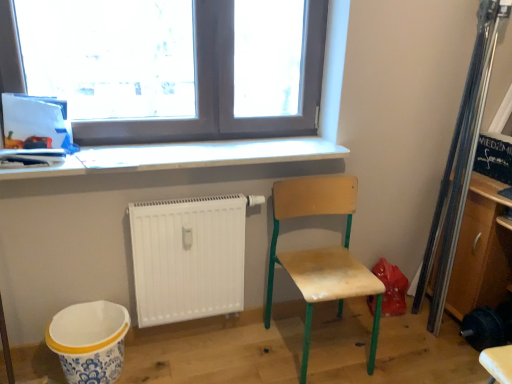
In order to face white ceramic mixing bowl at lower left, should I rotate leftwards or rightwards?

It's best to rotate left around 20.884 degrees.

This screenshot has width=512, height=384. What do you see at coordinates (176, 66) in the screenshot?
I see `transparent glass window at upper center` at bounding box center [176, 66].

What are the coordinates of `wooden cabinet at right` in the screenshot? It's located at (481, 250).

Identify the location of white glossy counter top at upper center. This screenshot has width=512, height=384. click(x=184, y=156).

Between white matte radiator at lower center and transparent glass window at upper center, which one has more height?

Standing taller between the two is transparent glass window at upper center.

Does point (172, 283) appear closer or farther from the camera than point (311, 16)?

Clearly, point (172, 283) is closer to the camera than point (311, 16).

From a real-world perspective, is white matte radiator at lower center physically above transparent glass window at upper center?

No.

Is white matte radiator at lower center facing towards transparent glass window at upper center?

No, white matte radiator at lower center is not turned towards transparent glass window at upper center.

From the image's perspective, which object appears higher, wooden cabinet at right or white ceramic mixing bowl at lower left?

wooden cabinet at right is shown above in the image.

Does wooden cabinet at right have a lesser height compared to white ceramic mixing bowl at lower left?

In fact, wooden cabinet at right may be taller than white ceramic mixing bowl at lower left.

Consider the image. Would you say wooden cabinet at right is inside or outside white ceramic mixing bowl at lower left?

wooden cabinet at right lies outside white ceramic mixing bowl at lower left.

How different are the orientations of white glossy counter top at upper center and wooden cabinet at right in degrees?

The facing directions of white glossy counter top at upper center and wooden cabinet at right are 90.1 degrees apart.

Considering the relative positions of white glossy counter top at upper center and wooden cabinet at right in the image provided, is white glossy counter top at upper center to the left or to the right of wooden cabinet at right?

white glossy counter top at upper center is to the left of wooden cabinet at right.

Is white glossy counter top at upper center spatially inside wooden cabinet at right, or outside of it?

white glossy counter top at upper center is spatially situated outside wooden cabinet at right.

From the image's perspective, does transparent glass window at upper center appear higher than wooden cabinet at right?

Yes.

Between point (199, 57) and point (455, 309), which one is positioned in front?

The point (199, 57) is closer.

In the scene shown: Is transparent glass window at upper center positioned behind wooden cabinet at right?

No, transparent glass window at upper center is in front of wooden cabinet at right.

Is transparent glass window at upper center taller or shorter than wooden cabinet at right?

In the image, transparent glass window at upper center appears to be shorter than wooden cabinet at right.

Would you say white matte radiator at lower center is part of wooden cabinet at right's contents?

No, white matte radiator at lower center is located outside of wooden cabinet at right.

Is wooden cabinet at right positioned with its back to white matte radiator at lower center?

No, white matte radiator at lower center is not at the back of wooden cabinet at right.

Considering the relative positions of wooden cabinet at right and white matte radiator at lower center in the image provided, is wooden cabinet at right behind white matte radiator at lower center?

No, it is not.

How different are the orientations of wooden cabinet at right and white matte radiator at lower center in degrees?

The angle between the facing direction of wooden cabinet at right and the facing direction of white matte radiator at lower center is 92.5 degrees.

Is wooden chair at lower right far from transparent glass window at upper center?

wooden chair at lower right is actually quite close to transparent glass window at upper center.

Based on the photo, from the image's perspective, who appears lower, wooden chair at lower right or transparent glass window at upper center?

From the image's view, wooden chair at lower right is below.

From a real-world perspective, between wooden chair at lower right and transparent glass window at upper center, who is vertically lower?

wooden chair at lower right, from a real-world perspective.

Does wooden chair at lower right appear on the left side of transparent glass window at upper center?

No, wooden chair at lower right is not to the left of transparent glass window at upper center.

Between transparent glass window at upper center and white glossy counter top at upper center, which one has smaller size?

white glossy counter top at upper center.

Which of these two, transparent glass window at upper center or white glossy counter top at upper center, is wider?

Wider between the two is white glossy counter top at upper center.

Is transparent glass window at upper center facing away from white glossy counter top at upper center?

No.

Consider the image. Could white glossy counter top at upper center be considered to be inside transparent glass window at upper center?

Definitely not — white glossy counter top at upper center is not inside transparent glass window at upper center.

At what (x,y) coordinates should I click in order to perform the action: click on window positioned vertically above the white matte radiator at lower center (from a real-world perspective). Please return your answer as a coordinate pair (x, y). Looking at the image, I should click on (176, 66).

Identify the location of shelf that appears above the white ceramic mixing bowl at lower left (from the image's perspective). (481, 250).

Looking at the image, which one is located further to white ceramic mixing bowl at lower left, white matte radiator at lower center or wooden cabinet at right?

wooden cabinet at right.

When comparing their distances from white ceramic mixing bowl at lower left, does wooden chair at lower right or wooden cabinet at right seem closer?

wooden chair at lower right.

Consider the image. When comparing their distances from white ceramic mixing bowl at lower left, does white glossy counter top at upper center or transparent glass window at upper center seem further?

transparent glass window at upper center lies further to white ceramic mixing bowl at lower left than the other object.

Considering their positions, is wooden chair at lower right positioned further to transparent glass window at upper center than white ceramic mixing bowl at lower left?

Based on the image, white ceramic mixing bowl at lower left appears to be further to transparent glass window at upper center.

Looking at the image, which one is located closer to transparent glass window at upper center, white glossy counter top at upper center or white ceramic mixing bowl at lower left?

white glossy counter top at upper center.

Which object lies nearer to the anchor point white matte radiator at lower center, wooden cabinet at right or wooden chair at lower right?

The object closer to white matte radiator at lower center is wooden chair at lower right.

Estimate the real-world distances between objects in this image. Which object is closer to wooden cabinet at right, wooden chair at lower right or white glossy counter top at upper center?

The object closer to wooden cabinet at right is wooden chair at lower right.

Considering their positions, is wooden cabinet at right positioned closer to wooden chair at lower right than transparent glass window at upper center?

Among the two, wooden cabinet at right is located nearer to wooden chair at lower right.

Find the location of a particular element. This screenshot has height=384, width=512. counter top between transparent glass window at upper center and white ceramic mixing bowl at lower left from top to bottom is located at coordinates (184, 156).

Locate an element on the screen. chair between white glossy counter top at upper center and wooden cabinet at right from left to right is located at coordinates (322, 254).

What are the coordinates of `radiator situated between white ceramic mixing bowl at lower left and wooden chair at lower right from left to right` in the screenshot? It's located at (189, 257).

The image size is (512, 384). In order to click on radiator between transparent glass window at upper center and wooden cabinet at right in the horizontal direction in this screenshot , I will do `click(189, 257)`.